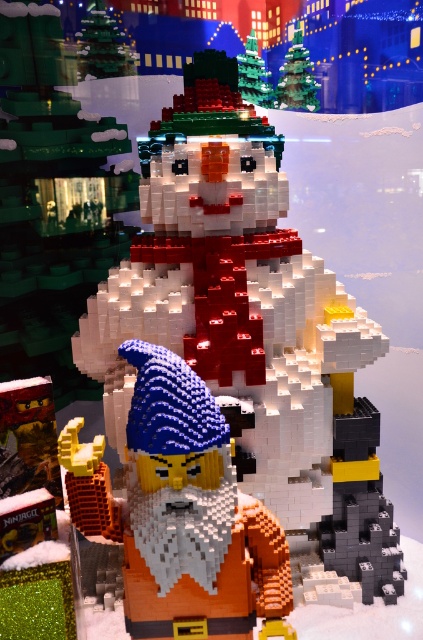
Who is higher up, orange matte/glossy wizard at lower left or matte white snowman at center?

matte white snowman at center

Between point (142, 387) and point (258, 72), which one is positioned in front?

Point (142, 387)

Locate an element on the screen. orange matte/glossy wizard at lower left is located at coordinates (192, 516).

Measure the distance between orange matte/glossy wizard at lower left and green matte christmas tree at upper center.

The distance of orange matte/glossy wizard at lower left from green matte christmas tree at upper center is 4.05 meters.

Is orange matte/glossy wizard at lower left bigger than green matte christmas tree at upper center?

Correct, orange matte/glossy wizard at lower left is larger in size than green matte christmas tree at upper center.

Who is more forward, (208, 624) or (277, 84)?

Point (208, 624) is more forward.

Identify the location of orange matte/glossy wizard at lower left. (192, 516).

Is white matte snowman at center further to the viewer compared to matte white snowman at center?

No.

Is white matte snowman at center thinner than matte white snowman at center?

In fact, white matte snowman at center might be wider than matte white snowman at center.

Locate an element on the screen. This screenshot has width=423, height=640. white matte snowman at center is located at coordinates (249, 330).